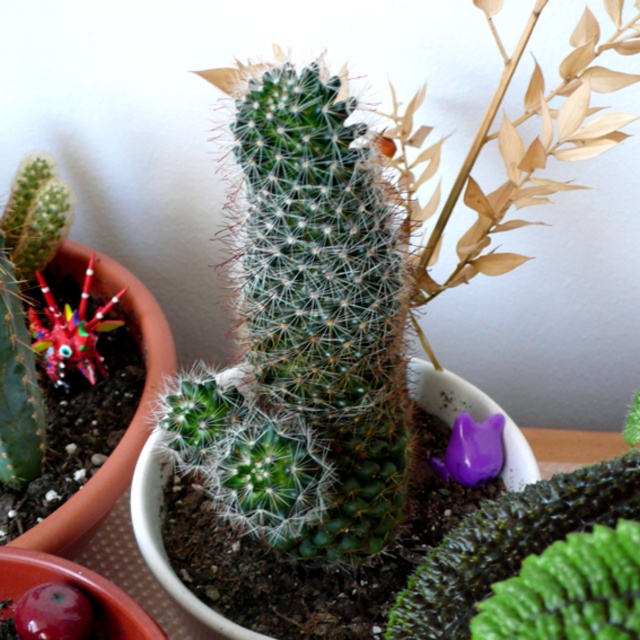
In the scene shown: You are organizing a display and need to place a new item between the glossy plastic flower at center and the purple matte cat at lower right. Based on their positions, which side should you place the new item closer to?

The glossy plastic flower at center is to the left of the purple matte cat at lower right, so placing the new item closer to the left side between them would maintain the existing arrangement.

You are standing in front of the potted plants. You want to place a new plant between the multicolored plastic flower at left and the viewer. Is there enough space to fit a new plant that is 40 inches wide?

The distance between the multicolored plastic flower at left and the viewer is 38.99 inches, which is slightly less than the 40 inches width of the new plant. Therefore, there is not enough space to fit the new plant.

You are a gardener who wants to place a new 18 inch wide decorative pot between the multicolored plastic flower at left and the glossy plastic flower at center. Is there enough space to fit it without moving the existing flowers?

The multicolored plastic flower at left and glossy plastic flower at center are 17.58 inches apart from each other. Since the new pot is 18 inches wide, it is slightly wider than the available space. Therefore, there is not enough space to fit the 18 inch wide decorative pot between them without moving the existing flowers.